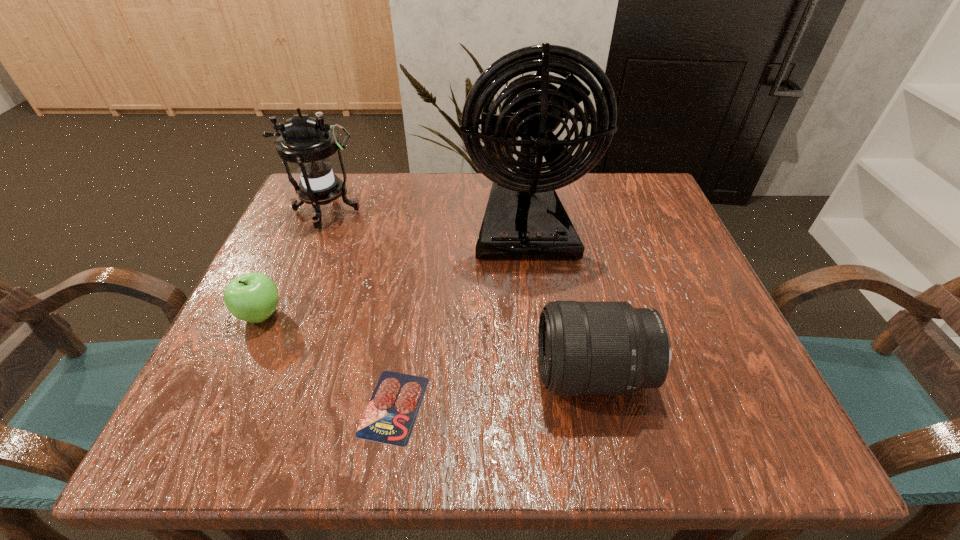
I want to click on free location located 0.390m on the surface of the third shortest object, so click(297, 374).

Find the location of a particular element. This screenshot has height=540, width=960. free space located on the surface of the third shortest object is located at coordinates (297, 374).

At what (x,y) coordinates should I click in order to perform the action: click on free space located on the right of the second shortest object. Please return your answer as a coordinate pair (x, y). The image size is (960, 540). Looking at the image, I should click on (334, 314).

The width and height of the screenshot is (960, 540). In order to click on vacant region located on the back of the salami in this screenshot , I will do (x=418, y=253).

Locate an element on the screen. fan at the far edge is located at coordinates (524, 218).

At what (x,y) coordinates should I click in order to perform the action: click on lantern located at the far edge. Please return your answer as a coordinate pair (x, y). The image size is (960, 540). Looking at the image, I should click on (308, 142).

At what (x,y) coordinates should I click in order to perform the action: click on telephoto lens at the near edge. Please return your answer as a coordinate pair (x, y). This screenshot has width=960, height=540. Looking at the image, I should click on (585, 348).

Image resolution: width=960 pixels, height=540 pixels. What are the coordinates of `salami located at the near edge` in the screenshot? It's located at click(x=390, y=416).

Find the location of a particular element. This screenshot has height=540, width=960. lantern at the left edge is located at coordinates (308, 142).

Locate an element on the screen. The height and width of the screenshot is (540, 960). apple that is positioned at the left edge is located at coordinates 253,297.